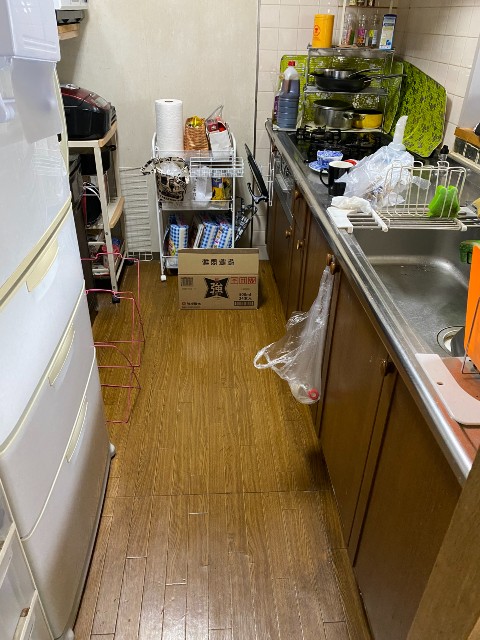
Where is `cabinets`? The height and width of the screenshot is (640, 480). cabinets is located at coordinates (414, 454), (367, 388), (316, 268), (298, 246), (277, 235).